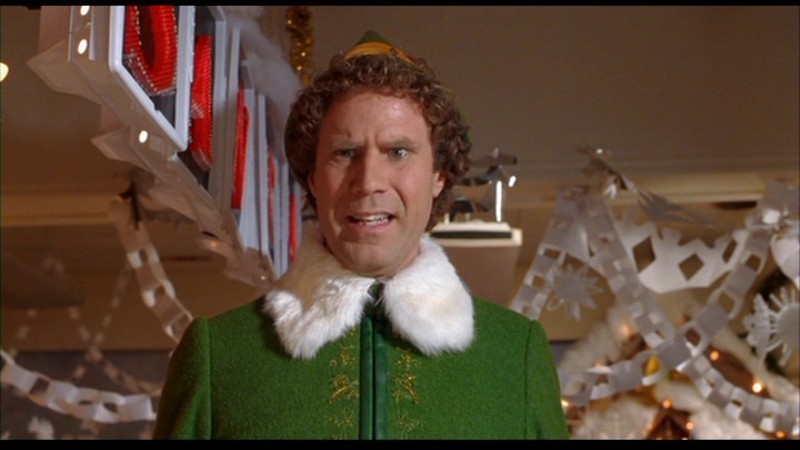
This screenshot has width=800, height=450. I want to click on paper snowflakes, so click(x=596, y=236), click(x=694, y=253), click(x=660, y=329), click(x=733, y=300), click(x=725, y=399), click(x=97, y=411), click(x=141, y=247).